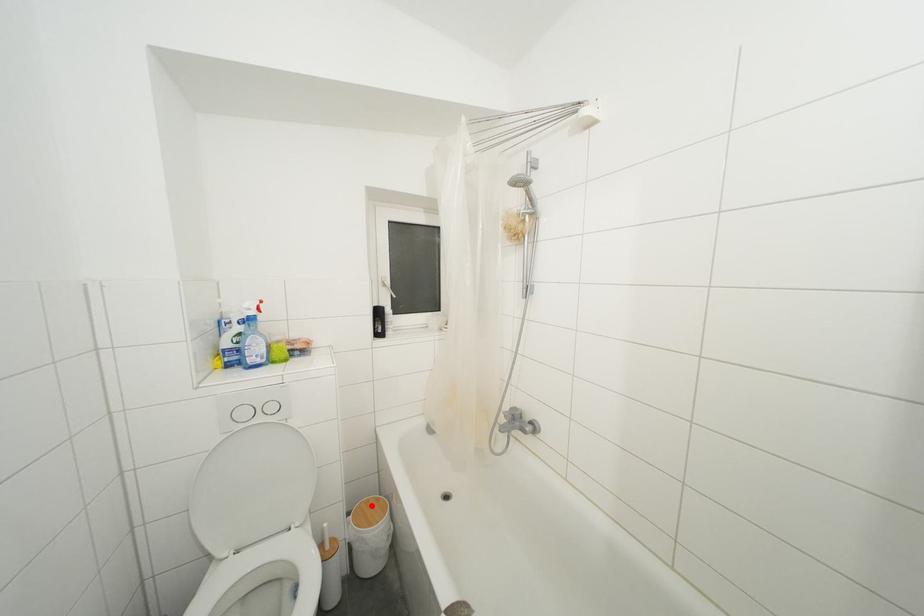
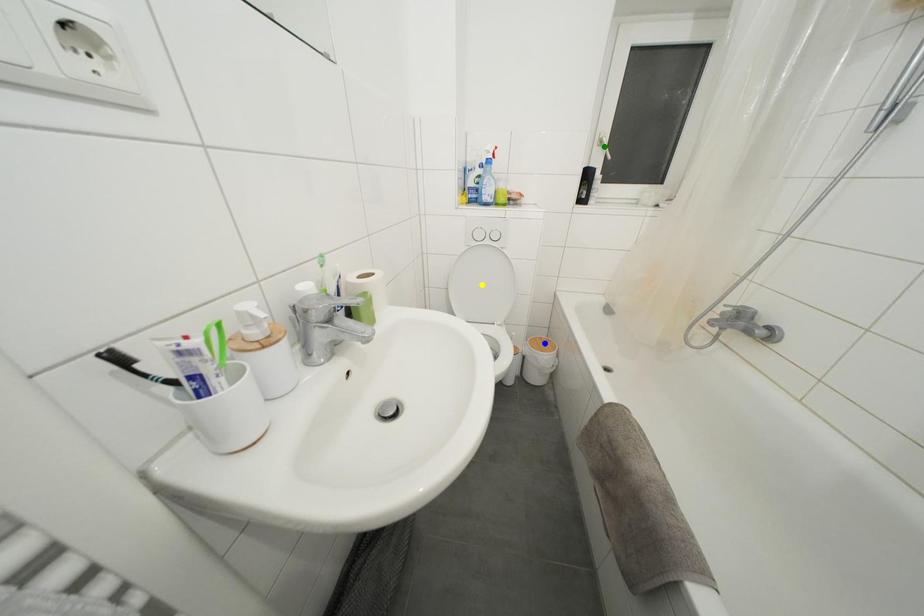
Question: I am providing you with two images of the same scene from different viewpoints. A red point is marked on the first image. You are given multiple points on the second image. Which mark in image 2 goes with the point in image 1?

Choices:
 (A) green point
 (B) yellow point
 (C) blue point

Answer: (C)